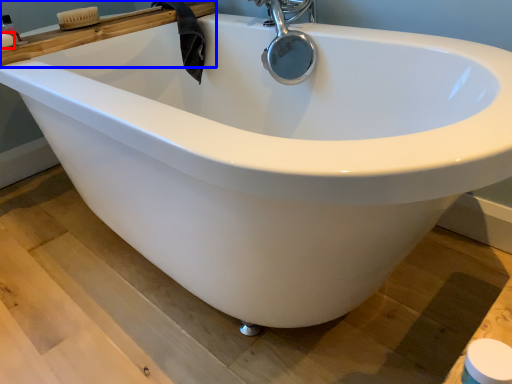
Question: Which object appears farthest to the camera in this image, soap (highlighted by a red box) or ledge (highlighted by a blue box)?

Choices:
 (A) soap
 (B) ledge

Answer: (B)